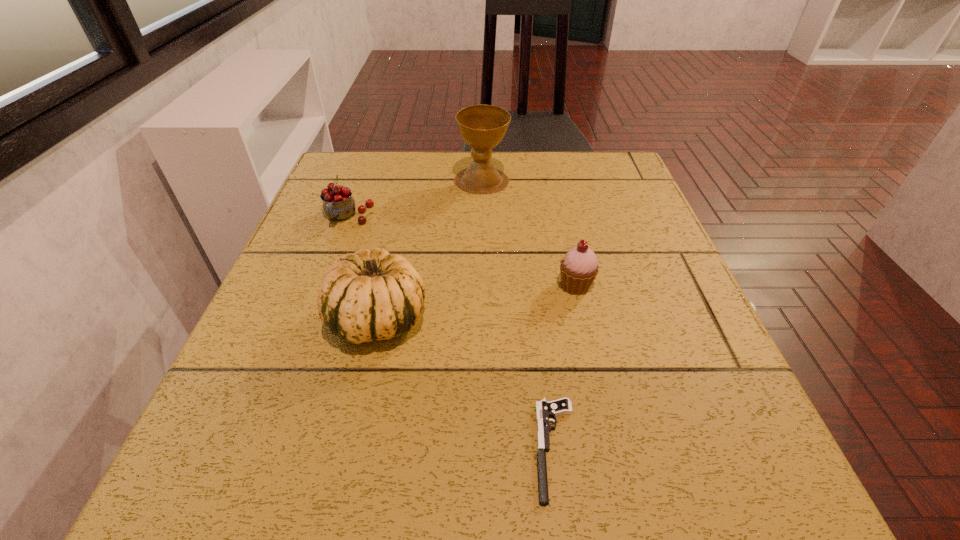
Locate an element on the screen. The height and width of the screenshot is (540, 960). blank area located 0.230m on the back of the rightmost object is located at coordinates (558, 205).

What are the coordinates of `vacant space located on the front-facing side of the pistol` in the screenshot? It's located at (354, 449).

Where is `vacant space located on the front-facing side of the pistol`? The width and height of the screenshot is (960, 540). vacant space located on the front-facing side of the pistol is located at coordinates (444, 449).

Identify the location of free location located 0.320m on the front-facing side of the pistol. The width and height of the screenshot is (960, 540). (294, 449).

At what (x,y) coordinates should I click in order to perform the action: click on object located in the far edge section of the desktop. Please return your answer as a coordinate pair (x, y). The width and height of the screenshot is (960, 540). Looking at the image, I should click on (483, 127).

The width and height of the screenshot is (960, 540). I want to click on object positioned at the near edge, so click(544, 409).

At what (x,y) coordinates should I click in order to perform the action: click on gourd at the left edge. Please return your answer as a coordinate pair (x, y). Image resolution: width=960 pixels, height=540 pixels. Looking at the image, I should click on (373, 295).

You are a GUI agent. You are given a task and a screenshot of the screen. Output one action in this format:
    pyautogui.click(x=<x>, y=<y>)
    Task: Click on the cherry that is at the left edge
    This screenshot has height=540, width=960.
    Given the screenshot: What is the action you would take?
    pyautogui.click(x=338, y=204)

At what (x,y) coordinates should I click in order to perform the action: click on vacant area at the far edge. Please return your answer as a coordinate pair (x, y). This screenshot has width=960, height=540. Looking at the image, I should click on (467, 153).

The height and width of the screenshot is (540, 960). What are the coordinates of `vacant space at the near edge` in the screenshot? It's located at pyautogui.click(x=436, y=477).